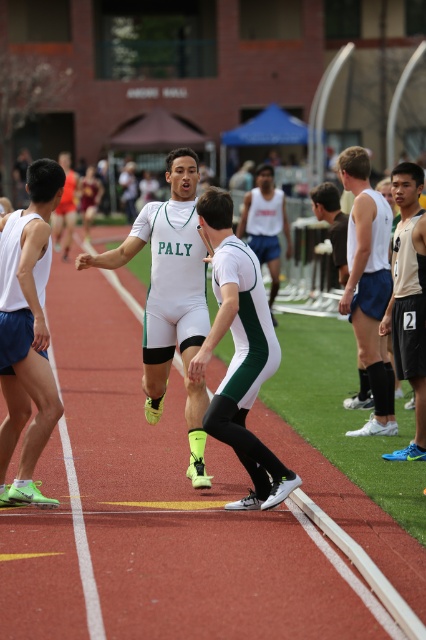
You are a photographer positioned at the center of the track. You notice two items in the image, the matte white shorts at left and the tan jersey at right. Which item appears taller in the image?

The matte white shorts at left appears taller than the tan jersey at right in the image.